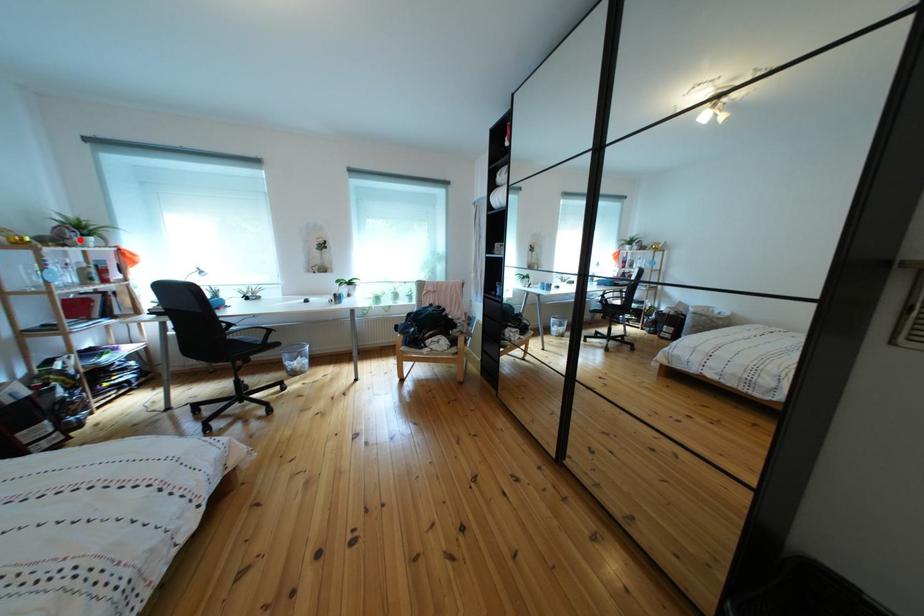
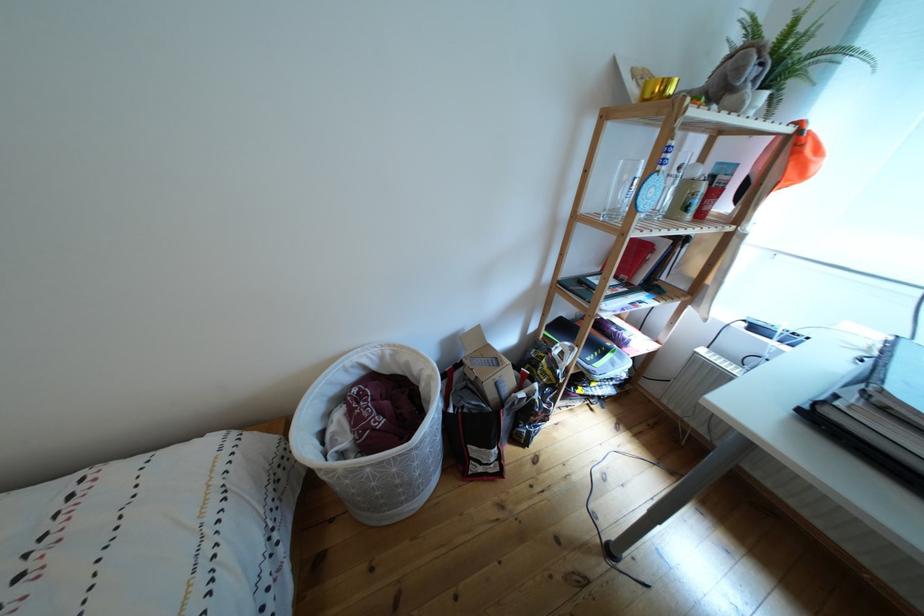
Where in the second image is the point corresponding to the highlighted location from the first image?

(762, 77)